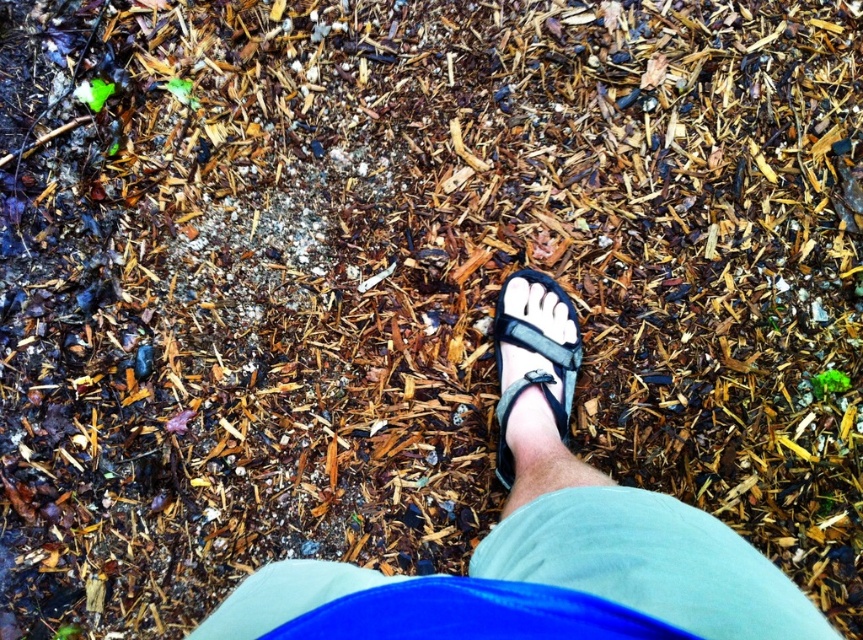
Question: Does black fabric sandal at center have a larger size compared to black leather sandal at center?

Choices:
 (A) yes
 (B) no

Answer: (A)

Question: Observing the image, what is the correct spatial positioning of black fabric sandal at center in reference to black leather sandal at center?

Choices:
 (A) below
 (B) above

Answer: (A)

Question: Does black fabric sandal at center have a larger size compared to black leather sandal at center?

Choices:
 (A) yes
 (B) no

Answer: (A)

Question: Which point is closer to the camera taking this photo?

Choices:
 (A) (534, 376)
 (B) (653, 579)

Answer: (B)